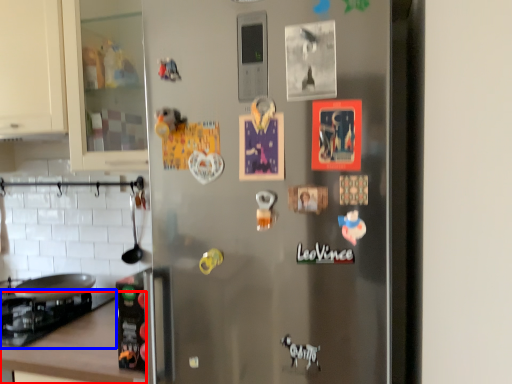
Question: Which point is further to the camera, counter top (highlighted by a red box) or gas stove (highlighted by a blue box)?

Choices:
 (A) counter top
 (B) gas stove

Answer: (B)